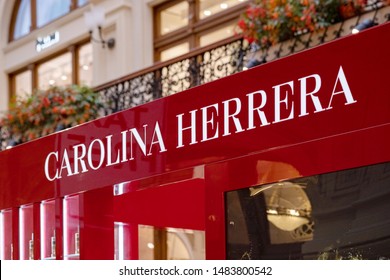
This screenshot has height=280, width=390. Find the location of `light pink windows`. light pink windows is located at coordinates (18, 82), (50, 72), (81, 59).